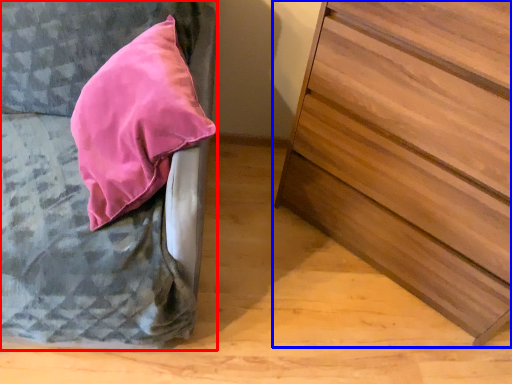
Question: Which of the following is the farthest to the observer, furniture (highlighted by a red box) or chest of drawers (highlighted by a blue box)?

Choices:
 (A) furniture
 (B) chest of drawers

Answer: (B)